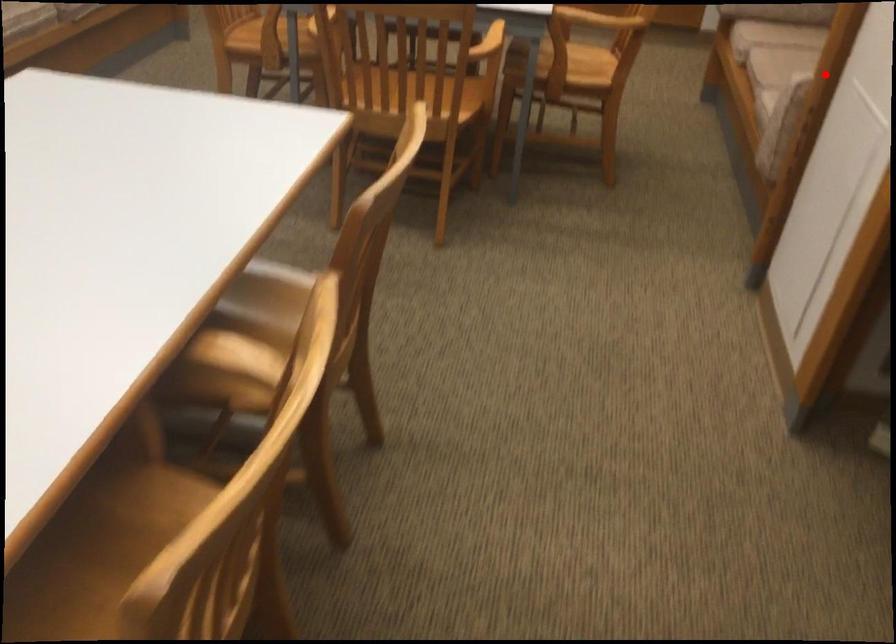
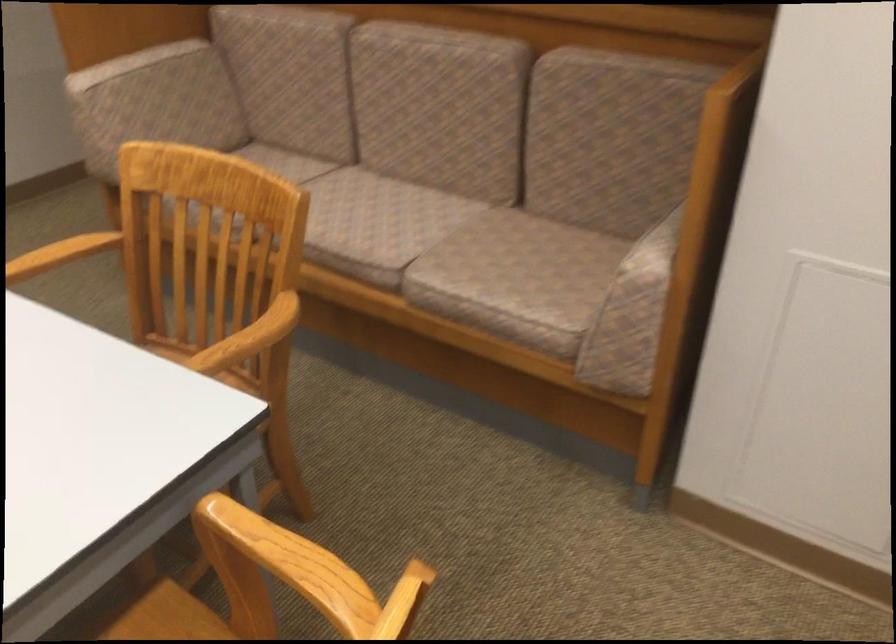
Question: I am providing you with two images of the same scene from different viewpoints. Image1 has a red point marked. In image2, the corresponding 3D location appears at what relative position? Reply with the corresponding letter.

Choices:
 (A) Closer
 (B) Farther

Answer: (A)